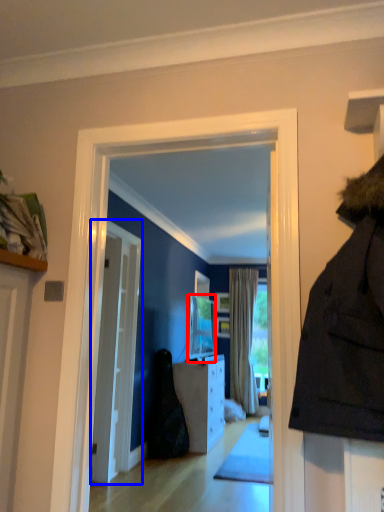
Question: Which object appears farthest to the camera in this image, television (highlighted by a red box) or door (highlighted by a blue box)?

Choices:
 (A) television
 (B) door

Answer: (A)